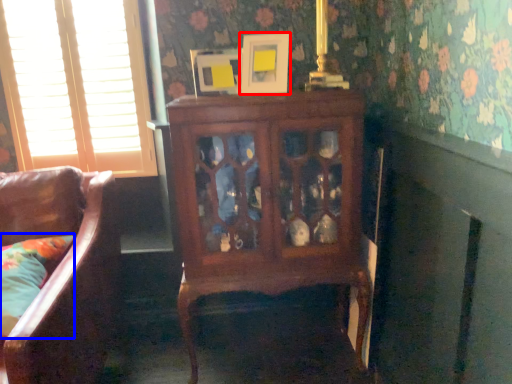
Question: Which object is closer to the camera taking this photo, picture frame (highlighted by a red box) or pillow (highlighted by a blue box)?

Choices:
 (A) picture frame
 (B) pillow

Answer: (B)